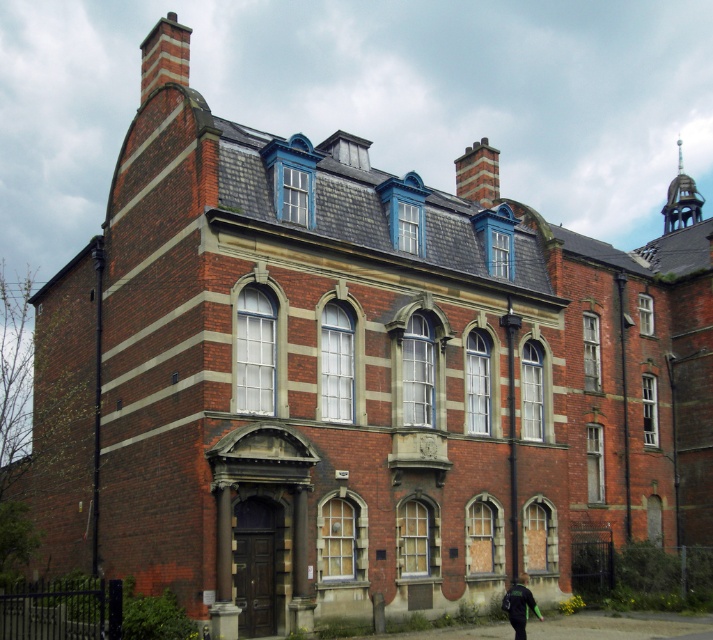
You are standing in front of the historic brick building. There is a brick chimney at upper left represented by point (164, 54). Where would you look to find the chimney?

The brick chimney at upper left is located at the coordinates point (164, 54).

You are an architect inspecting the building. You notice the brick chimney at upper center and the green fabric jacket at lower center. Which object occupies more space in the image?

The brick chimney at upper center is bigger than the green fabric jacket at lower center, so it occupies more space in the image.